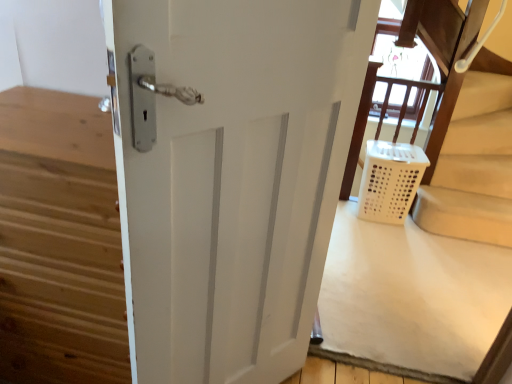
Question: In terms of size, does white matte door at center appear bigger or smaller than white plastic laundry basket at lower right?

Choices:
 (A) big
 (B) small

Answer: (A)

Question: In terms of width, does white matte door at center look wider or thinner when compared to white plastic laundry basket at lower right?

Choices:
 (A) thin
 (B) wide

Answer: (A)

Question: Based on their relative distances, which object is nearer to the white plastic laundry basket at lower right?

Choices:
 (A) white matte door at center
 (B) white plastic laundry basket at lower right

Answer: (B)

Question: Which of these objects is positioned farthest from the white plastic laundry basket at lower right?

Choices:
 (A) white matte door at center
 (B) white plastic laundry basket at lower right

Answer: (A)